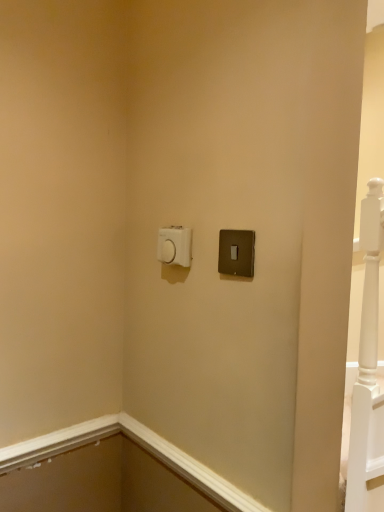
Find the location of `white plastic light switch at upper center, which appears as the second light switch when viewed from the right`. white plastic light switch at upper center, which appears as the second light switch when viewed from the right is located at coordinates (175, 245).

What do you see at coordinates (175, 245) in the screenshot?
I see `white plastic light switch at upper center, the 2th light switch positioned from the front` at bounding box center [175, 245].

This screenshot has height=512, width=384. What are the coordinates of `satin black switch at upper right, which ranks as the 1th light switch in right-to-left order` in the screenshot? It's located at (236, 252).

Describe the element at coordinates (236, 252) in the screenshot. I see `satin black switch at upper right, which ranks as the 1th light switch in right-to-left order` at that location.

Where is `white plastic light switch at upper center, marked as the first light switch in a left-to-right arrangement`? The width and height of the screenshot is (384, 512). white plastic light switch at upper center, marked as the first light switch in a left-to-right arrangement is located at coordinates (175, 245).

Which object is positioned more to the left, white plastic light switch at upper center, which appears as the second light switch when viewed from the right, or satin black switch at upper right, which ranks as the 1th light switch in right-to-left order?

white plastic light switch at upper center, which appears as the second light switch when viewed from the right, is more to the left.

Is the depth of white plastic light switch at upper center, marked as the first light switch in a left-to-right arrangement, greater than that of satin black switch at upper right, placed as the 2th light switch when sorted from back to front?

Yes, it is.

Between point (160, 245) and point (248, 248), which one is positioned in front?

The point (248, 248) is in front.

From the image's perspective, is white plastic light switch at upper center, the first light switch in the back-to-front sequence, positioned above or below satin black switch at upper right, the 1th light switch from the front?

white plastic light switch at upper center, the first light switch in the back-to-front sequence, is situated higher than satin black switch at upper right, the 1th light switch from the front, in the image.

From a real-world perspective, between white plastic light switch at upper center, which appears as the second light switch when viewed from the right, and satin black switch at upper right, which is the 2th light switch from left to right, who is vertically higher?

In real-world perspective, white plastic light switch at upper center, which appears as the second light switch when viewed from the right, is above.

Which of these two, white plastic light switch at upper center, the first light switch in the back-to-front sequence, or satin black switch at upper right, placed as the 2th light switch when sorted from back to front, is thinner?

satin black switch at upper right, placed as the 2th light switch when sorted from back to front, is thinner.

Considering the sizes of objects white plastic light switch at upper center, the first light switch in the back-to-front sequence, and satin black switch at upper right, placed as the 2th light switch when sorted from back to front, in the image provided, who is taller, white plastic light switch at upper center, the first light switch in the back-to-front sequence, or satin black switch at upper right, placed as the 2th light switch when sorted from back to front,?

With more height is satin black switch at upper right, placed as the 2th light switch when sorted from back to front.

Is white plastic light switch at upper center, the first light switch in the back-to-front sequence, smaller than satin black switch at upper right, the 1th light switch from the front?

No.

Is satin black switch at upper right, which is the 2th light switch from left to right, surrounded by white plastic light switch at upper center, marked as the first light switch in a left-to-right arrangement?

No, satin black switch at upper right, which is the 2th light switch from left to right, is located outside of white plastic light switch at upper center, marked as the first light switch in a left-to-right arrangement.

Would you consider white plastic light switch at upper center, the first light switch in the back-to-front sequence, to be distant from satin black switch at upper right, placed as the 2th light switch when sorted from back to front?

No.

Is satin black switch at upper right, placed as the 2th light switch when sorted from back to front, at the back of white plastic light switch at upper center, the 2th light switch positioned from the front?

That's not correct — white plastic light switch at upper center, the 2th light switch positioned from the front, is not looking away from satin black switch at upper right, placed as the 2th light switch when sorted from back to front.

What's the angular difference between white plastic light switch at upper center, which appears as the second light switch when viewed from the right, and satin black switch at upper right, placed as the 2th light switch when sorted from back to front,'s facing directions?

white plastic light switch at upper center, which appears as the second light switch when viewed from the right, and satin black switch at upper right, placed as the 2th light switch when sorted from back to front, are facing 0.00885 degrees away from each other.

How much distance is there between white plastic light switch at upper center, the 2th light switch positioned from the front, and satin black switch at upper right, which ranks as the 1th light switch in right-to-left order?

A distance of 5.13 inches exists between white plastic light switch at upper center, the 2th light switch positioned from the front, and satin black switch at upper right, which ranks as the 1th light switch in right-to-left order.

The width and height of the screenshot is (384, 512). Identify the location of light switch located on the right of white plastic light switch at upper center, marked as the first light switch in a left-to-right arrangement. (236, 252).

Does satin black switch at upper right, the 1th light switch from the front, appear on the left side of white plastic light switch at upper center, the first light switch in the back-to-front sequence?

No.

Is the depth of satin black switch at upper right, the 1th light switch from the front, greater than that of white plastic light switch at upper center, the first light switch in the back-to-front sequence?

No, it is not.

Is point (224, 259) more distant than point (173, 234)?

No.

From the image's perspective, which is above, satin black switch at upper right, the 1th light switch from the front, or white plastic light switch at upper center, marked as the first light switch in a left-to-right arrangement?

white plastic light switch at upper center, marked as the first light switch in a left-to-right arrangement, is shown above in the image.

From a real-world perspective, which object rests below the other?

From a 3D spatial view, satin black switch at upper right, the 1th light switch from the front, is below.

Between satin black switch at upper right, placed as the 2th light switch when sorted from back to front, and white plastic light switch at upper center, which appears as the second light switch when viewed from the right, which one has smaller width?

Thinner between the two is satin black switch at upper right, placed as the 2th light switch when sorted from back to front.

Is satin black switch at upper right, which ranks as the 1th light switch in right-to-left order, shorter than white plastic light switch at upper center, which appears as the second light switch when viewed from the right?

No.

In the scene shown: Which of these two, satin black switch at upper right, the 1th light switch from the front, or white plastic light switch at upper center, the first light switch in the back-to-front sequence, is bigger?

Bigger between the two is white plastic light switch at upper center, the first light switch in the back-to-front sequence.

Choose the correct answer: Is satin black switch at upper right, the 1th light switch from the front, inside white plastic light switch at upper center, marked as the first light switch in a left-to-right arrangement, or outside it?

The correct answer is: outside.

Can you see satin black switch at upper right, which ranks as the 1th light switch in right-to-left order, touching white plastic light switch at upper center, the 2th light switch positioned from the front?

No, satin black switch at upper right, which ranks as the 1th light switch in right-to-left order, is not in contact with white plastic light switch at upper center, the 2th light switch positioned from the front.

Does satin black switch at upper right, placed as the 2th light switch when sorted from back to front, turn towards white plastic light switch at upper center, the 2th light switch positioned from the front?

No, satin black switch at upper right, placed as the 2th light switch when sorted from back to front, is not facing towards white plastic light switch at upper center, the 2th light switch positioned from the front.

How far apart are satin black switch at upper right, which ranks as the 1th light switch in right-to-left order, and white plastic light switch at upper center, which appears as the second light switch when viewed from the right?

satin black switch at upper right, which ranks as the 1th light switch in right-to-left order, and white plastic light switch at upper center, which appears as the second light switch when viewed from the right, are 5.13 inches apart.

Where is `light switch located on the left of satin black switch at upper right, which is the 2th light switch from left to right`? The width and height of the screenshot is (384, 512). light switch located on the left of satin black switch at upper right, which is the 2th light switch from left to right is located at coordinates (175, 245).

I want to click on light switch above the satin black switch at upper right, placed as the 2th light switch when sorted from back to front (from the image's perspective), so pyautogui.click(x=175, y=245).

What are the coordinates of `light switch above the satin black switch at upper right, placed as the 2th light switch when sorted from back to front (from a real-world perspective)` in the screenshot? It's located at (175, 245).